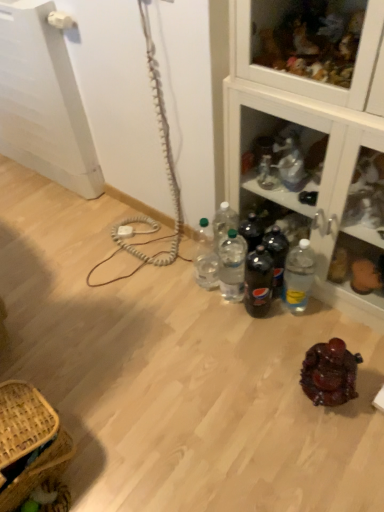
This screenshot has width=384, height=512. In order to click on vacant area situated to the left side of clear plastic bottles at center, marked as the second bottle in a left-to-right arrangement in this screenshot , I will do `click(190, 298)`.